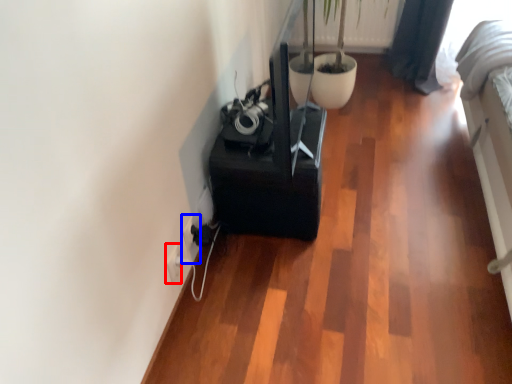
Question: Among these objects, which one is farthest to the camera, electric outlet (highlighted by a red box) or electric outlet (highlighted by a blue box)?

Choices:
 (A) electric outlet
 (B) electric outlet

Answer: (B)